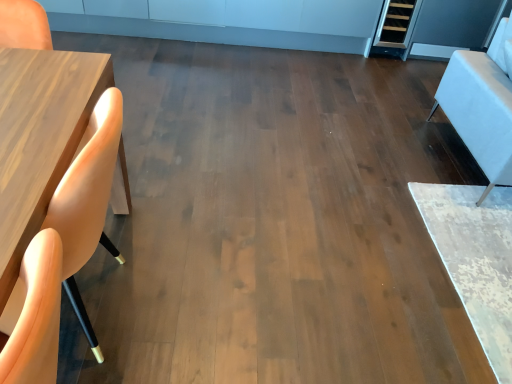
What are the coordinates of `vacant space to the right of matte wood chair at left` in the screenshot? It's located at (221, 279).